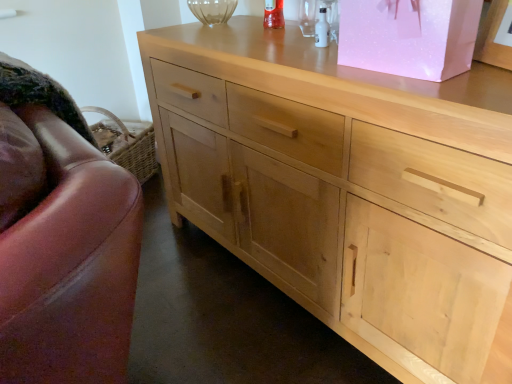
The height and width of the screenshot is (384, 512). Find the location of `pink paper bag at upper right`. pink paper bag at upper right is located at coordinates (409, 36).

In the scene shown: Measure the distance between point (278, 153) and camera.

The distance of point (278, 153) from camera is 3.91 feet.

This screenshot has width=512, height=384. Find the location of `leather swivel chair at left`. leather swivel chair at left is located at coordinates (62, 240).

Which object is positioned more to the right, pink paper bag at upper right or natural wood cabinet at center?

From the viewer's perspective, pink paper bag at upper right appears more on the right side.

From the image's perspective, which object appears higher, pink paper bag at upper right or natural wood cabinet at center?

pink paper bag at upper right.

Looking at this image, between pink paper bag at upper right and natural wood cabinet at center, which one has more height?

natural wood cabinet at center.

What's the angular difference between leather swivel chair at left and natural wood cabinet at center's facing directions?

leather swivel chair at left and natural wood cabinet at center are facing 3.01 degrees away from each other.

Which of these two, leather swivel chair at left or natural wood cabinet at center, is wider?

Wider between the two is natural wood cabinet at center.

Is there a large distance between leather swivel chair at left and natural wood cabinet at center?

No, leather swivel chair at left is not far from natural wood cabinet at center.

Does leather swivel chair at left turn towards natural wood cabinet at center?

No, leather swivel chair at left is not facing towards natural wood cabinet at center.

Does natural wood cabinet at center appear on the right side of pink paper bag at upper right?

No.

Considering the relative sizes of natural wood cabinet at center and pink paper bag at upper right in the image provided, is natural wood cabinet at center thinner than pink paper bag at upper right?

No, natural wood cabinet at center is not thinner than pink paper bag at upper right.

Does natural wood cabinet at center turn towards pink paper bag at upper right?

No.

Is the position of natural wood cabinet at center less distant than that of pink paper bag at upper right?

Yes.

Is natural wood cabinet at center wider than leather swivel chair at left?

Yes, natural wood cabinet at center is wider than leather swivel chair at left.

Measure the distance from natural wood cabinet at center to leather swivel chair at left.

natural wood cabinet at center is 60.51 centimeters from leather swivel chair at left.

From the image's perspective, would you say natural wood cabinet at center is positioned over leather swivel chair at left?

No, from the image's perspective, natural wood cabinet at center is not on top of leather swivel chair at left.

From a real-world perspective, is natural wood cabinet at center located beneath leather swivel chair at left?

Yes, from a real-world perspective, natural wood cabinet at center is beneath leather swivel chair at left.

Who is shorter, pink paper bag at upper right or leather swivel chair at left?

With less height is pink paper bag at upper right.

Could you tell me if pink paper bag at upper right is facing leather swivel chair at left?

No, pink paper bag at upper right does not turn towards leather swivel chair at left.

From the image's perspective, is pink paper bag at upper right positioned above or below leather swivel chair at left?

Clearly, from the image's perspective, pink paper bag at upper right is above leather swivel chair at left.

Is pink paper bag at upper right far away from leather swivel chair at left?

No.

Between leather swivel chair at left and pink paper bag at upper right, which one has larger size?

With larger size is leather swivel chair at left.

I want to click on cabinetry behind the leather swivel chair at left, so click(x=409, y=36).

Is leather swivel chair at left completely or partially outside of pink paper bag at upper right?

leather swivel chair at left lies outside pink paper bag at upper right's area.

Where is `chest of drawers below the pink paper bag at upper right (from a real-world perspective)`? The height and width of the screenshot is (384, 512). chest of drawers below the pink paper bag at upper right (from a real-world perspective) is located at coordinates (347, 189).

I want to click on chest of drawers below the leather swivel chair at left (from the image's perspective), so click(347, 189).

From the image, which object appears to be farther from leather swivel chair at left, pink paper bag at upper right or natural wood cabinet at center?

pink paper bag at upper right lies further to leather swivel chair at left than the other object.

Estimate the real-world distances between objects in this image. Which object is closer to pink paper bag at upper right, leather swivel chair at left or natural wood cabinet at center?

natural wood cabinet at center is closer to pink paper bag at upper right.

Looking at the image, which one is located closer to pink paper bag at upper right, natural wood cabinet at center or leather swivel chair at left?

natural wood cabinet at center lies closer to pink paper bag at upper right than the other object.

Considering their positions, is natural wood cabinet at center positioned closer to leather swivel chair at left than pink paper bag at upper right?

The object closer to leather swivel chair at left is natural wood cabinet at center.

Considering their positions, is pink paper bag at upper right positioned further to natural wood cabinet at center than leather swivel chair at left?

Among the two, leather swivel chair at left is located further to natural wood cabinet at center.

Which object lies nearer to the anchor point natural wood cabinet at center, leather swivel chair at left or pink paper bag at upper right?

Answer: pink paper bag at upper right lies closer to natural wood cabinet at center than the other object.

This screenshot has height=384, width=512. I want to click on the chest of drawers situated between leather swivel chair at left and pink paper bag at upper right from left to right, so click(x=347, y=189).